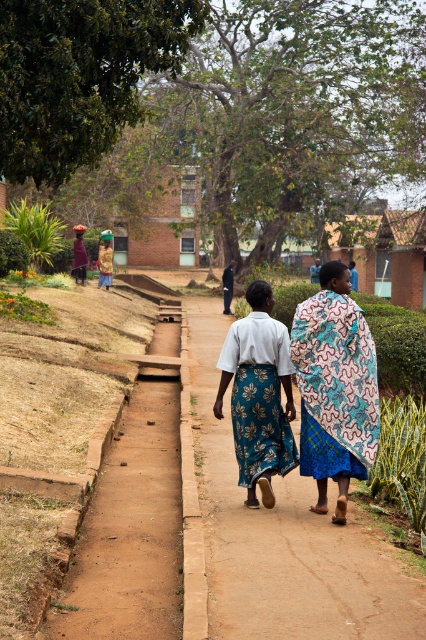
Does blue floral fabric at center have a smaller size compared to blue floral skirt at center?

Yes.

Between blue floral fabric at center and blue floral skirt at center, which one has more height?

Standing taller between the two is blue floral fabric at center.

Between point (314, 376) and point (264, 506), which one is positioned behind?

The point (264, 506) is behind.

The width and height of the screenshot is (426, 640). I want to click on blue floral fabric at center, so (334, 387).

Which is below, brown dirt path at center or blue floral skirt at center?

Positioned lower is brown dirt path at center.

Between point (385, 540) and point (273, 342), which one is positioned behind?

Positioned behind is point (273, 342).

Which is behind, point (233, 492) or point (239, 474)?

Positioned behind is point (233, 492).

Where is `brown dirt path at center`? The image size is (426, 640). brown dirt path at center is located at coordinates (287, 536).

How far apart are blue floral skirt at center and patterned fabric dress at center?

blue floral skirt at center is 49.51 centimeters away from patterned fabric dress at center.

Can you confirm if blue floral skirt at center is shorter than patterned fabric dress at center?

In fact, blue floral skirt at center may be taller than patterned fabric dress at center.

The width and height of the screenshot is (426, 640). What do you see at coordinates (259, 396) in the screenshot?
I see `blue floral skirt at center` at bounding box center [259, 396].

I want to click on blue floral skirt at center, so click(x=259, y=396).